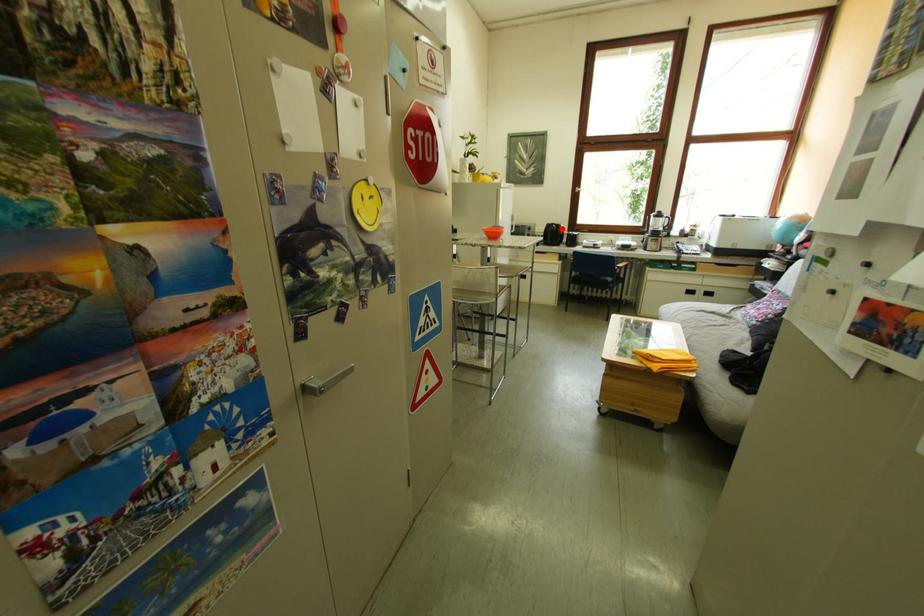
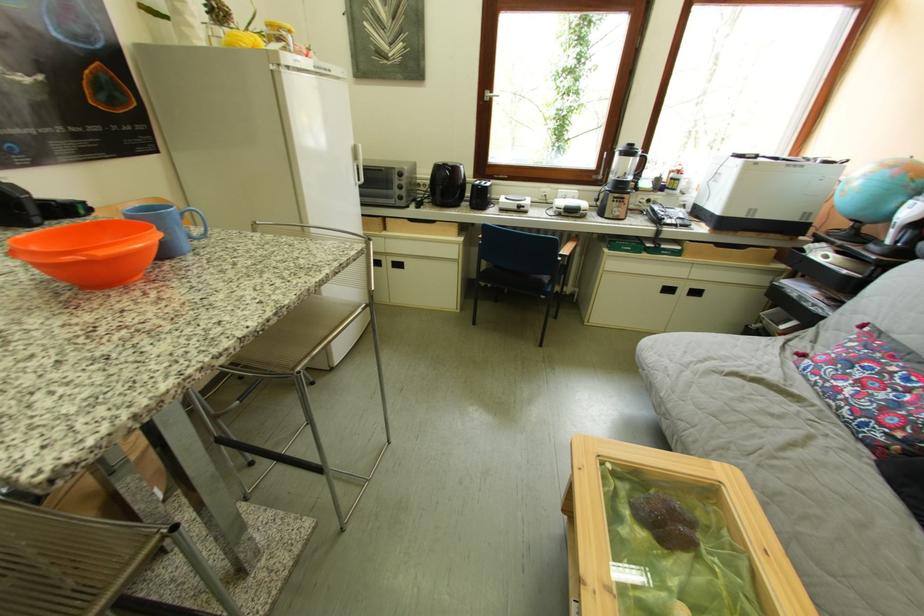
The point at the highlighted location is marked in the first image. Where is the corresponding point in the second image?

(451, 171)